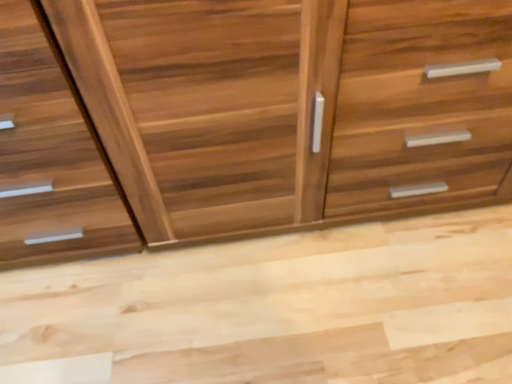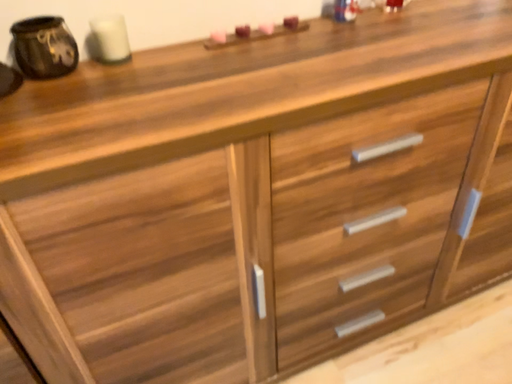
Question: Which way did the camera rotate in the video?

Choices:
 (A) rotated left
 (B) rotated right

Answer: (B)